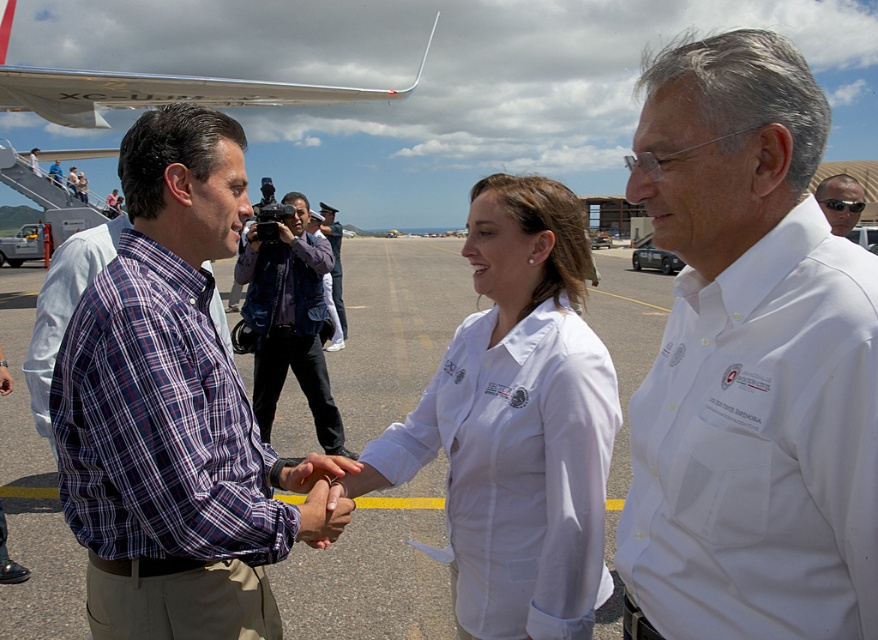
You are an airport security officer standing at the center of the tarmac. You need to check the white smooth shirt at center and the silver metallic airplane wing at upper left. Which object is closer to your current position?

The white smooth shirt at center is closer to your current position because it is located at the center of the tarmac, whereas the silver metallic airplane wing at upper left is positioned further away at the upper left corner.

You are standing at the point marked as point (824,202) on the airport tarmac. You need to walk to the security checkpoint located 12.68 feet away from your current position. Is the security checkpoint located in the direction of the three individuals shaking hands or in the opposite direction?

The security checkpoint is located in the direction of the three individuals shaking hands because the distance between point (824,202) and the viewer is 12.68 feet, which matches the distance to the checkpoint.

You are an airport security officer who needs to verify the identity of the person wearing the plaid cotton shirt at center and the sunglasses at center. Which object is closer to the top of the head of the person?

The plaid cotton shirt at center is taller than the sunglasses at center, so the plaid cotton shirt at center is closer to the top of the head of the person.